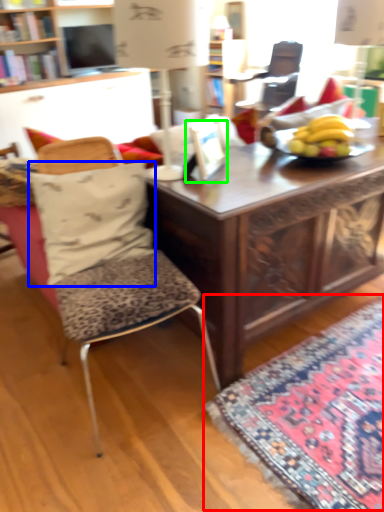
Question: Estimate the real-world distances between objects in this image. Which object is farther from mat (highlighted by a red box), pillow (highlighted by a blue box) or picture frame (highlighted by a green box)?

Choices:
 (A) pillow
 (B) picture frame

Answer: (B)